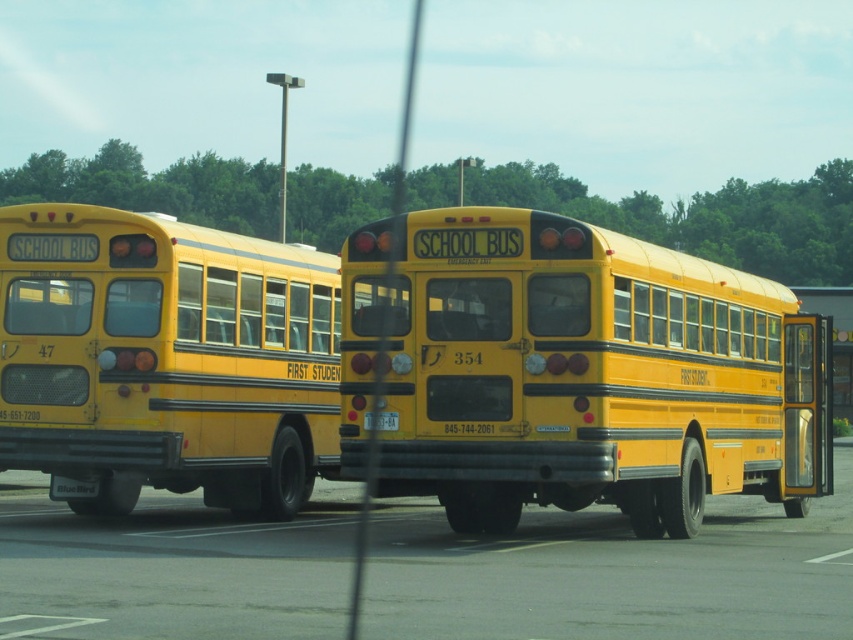
Question: Can you confirm if yellow matte/solid school bus at center is positioned to the left of matte yellow school bus at left?

Choices:
 (A) yes
 (B) no

Answer: (B)

Question: Observing the image, what is the correct spatial positioning of yellow matte/solid school bus at center in reference to yellow asphalt at lower center?

Choices:
 (A) below
 (B) above

Answer: (B)

Question: Which point is closer to the camera taking this photo?

Choices:
 (A) (635, 465)
 (B) (51, 312)

Answer: (A)

Question: Which is nearer to the yellow asphalt at lower center?

Choices:
 (A) yellow matte/solid school bus at center
 (B) matte yellow school bus at left

Answer: (A)

Question: Which object is positioned farthest from the matte yellow school bus at left?

Choices:
 (A) yellow asphalt at lower center
 (B) yellow matte/solid school bus at center

Answer: (B)

Question: Can you confirm if yellow matte/solid school bus at center is positioned to the right of matte yellow school bus at left?

Choices:
 (A) yes
 (B) no

Answer: (A)